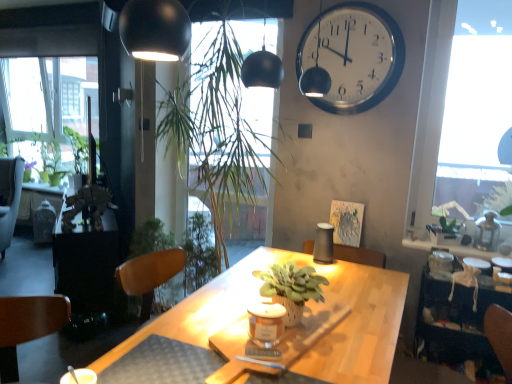
I want to click on free point to the left of matte glass candle at center, so click(232, 342).